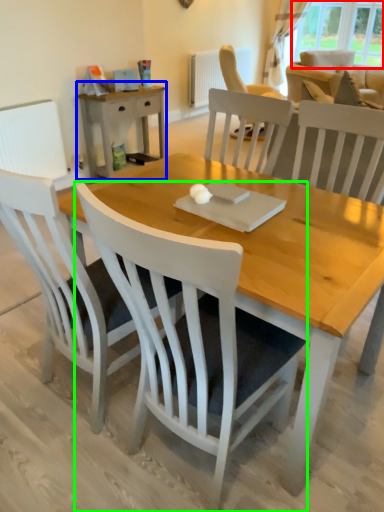
Question: Which object is positioned farthest from window (highlighted by a red box)? Select from nightstand (highlighted by a blue box) and chair (highlighted by a green box).

Choices:
 (A) nightstand
 (B) chair

Answer: (B)